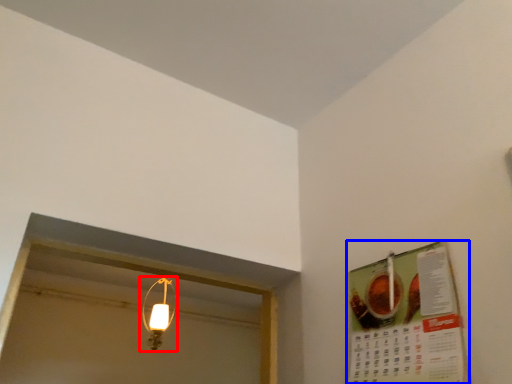
Question: Among these objects, which one is farthest to the camera, lamp (highlighted by a red box) or menu (highlighted by a blue box)?

Choices:
 (A) lamp
 (B) menu

Answer: (A)